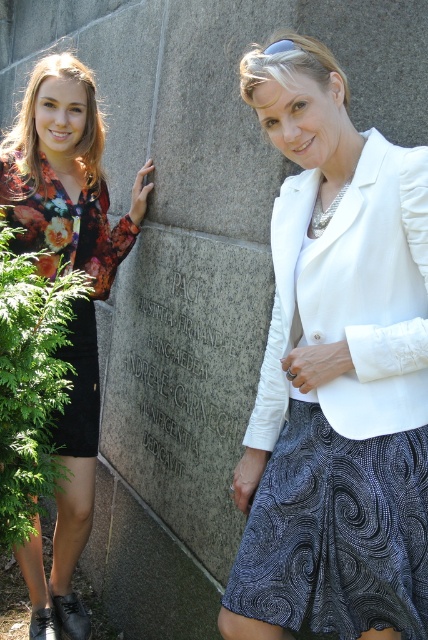
What do you see at coordinates (335, 372) in the screenshot? Image resolution: width=428 pixels, height=640 pixels. I see `white satin blazer at center` at bounding box center [335, 372].

Does white satin blazer at center have a greater width compared to floral print dress at left?

No.

Image resolution: width=428 pixels, height=640 pixels. Describe the element at coordinates (335, 372) in the screenshot. I see `white satin blazer at center` at that location.

This screenshot has width=428, height=640. In order to click on white satin blazer at center in this screenshot , I will do `click(335, 372)`.

Between floral print dress at left and black granite stone at center, which one appears on the right side from the viewer's perspective?

black granite stone at center

Does floral print dress at left appear over black granite stone at center?

Yes, floral print dress at left is above black granite stone at center.

Who is more distant from viewer, (14, 220) or (202, 460)?

Positioned behind is point (14, 220).

This screenshot has width=428, height=640. In order to click on floral print dress at left in this screenshot , I will do `click(73, 301)`.

Is white satin blazer at center wider than black granite stone at center?

No.

This screenshot has width=428, height=640. Find the location of `white satin blazer at center`. white satin blazer at center is located at coordinates (335, 372).

Find the location of `white satin blazer at center`. white satin blazer at center is located at coordinates (335, 372).